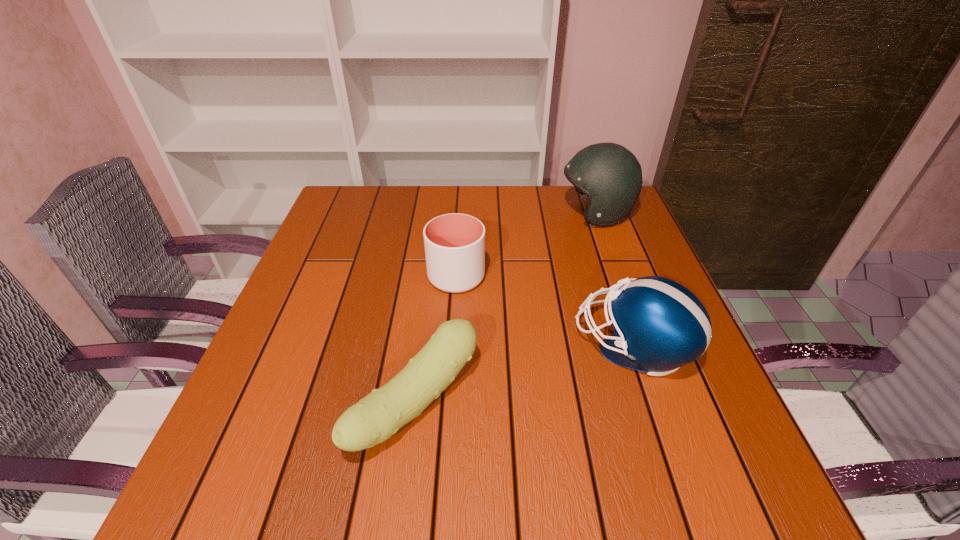
The image size is (960, 540). Identify the location of free space at the left edge of the desktop. pyautogui.click(x=267, y=361).

Find the location of `blank space at the right edge`. blank space at the right edge is located at coordinates (654, 393).

Identify the location of vacant region at the far left corner of the desktop. The width and height of the screenshot is (960, 540). [350, 187].

In the image, there is a desktop. At what (x,y) coordinates should I click in order to perform the action: click on blank space at the near left corner. Please return your answer as a coordinate pair (x, y). This screenshot has width=960, height=540. Looking at the image, I should click on (192, 488).

Find the location of `free region at the far right corner of the desktop`. free region at the far right corner of the desktop is located at coordinates (582, 222).

You are a GUI agent. You are given a task and a screenshot of the screen. Output one action in this format:
    pyautogui.click(x=<x>, y=<y>)
    Task: Click on the empty location between the shorter football helmet and the farther football helmet
    
    Given the screenshot: What is the action you would take?
    pyautogui.click(x=614, y=280)

Where is `free space between the cup and the shorter football helmet`? The height and width of the screenshot is (540, 960). free space between the cup and the shorter football helmet is located at coordinates (544, 311).

At what (x,y) coordinates should I click in order to perform the action: click on empty location between the second tallest object and the farther football helmet. Please return your answer as a coordinate pair (x, y). This screenshot has height=540, width=960. Looking at the image, I should click on click(x=614, y=280).

Find the location of a particular element. blank region between the shortest object and the second tallest object is located at coordinates (524, 374).

Where is `vacant area between the cup and the farthest object`? vacant area between the cup and the farthest object is located at coordinates (526, 245).